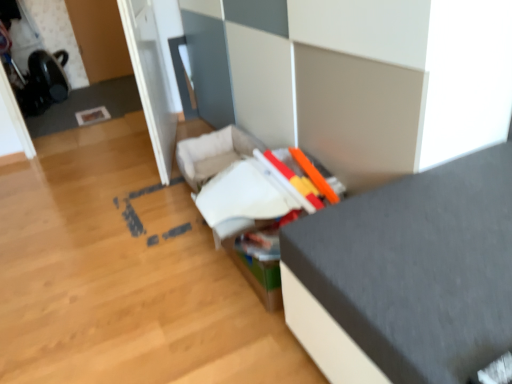
Find the location of `free space to the left of matte plastic storage box at center`. free space to the left of matte plastic storage box at center is located at coordinates (145, 265).